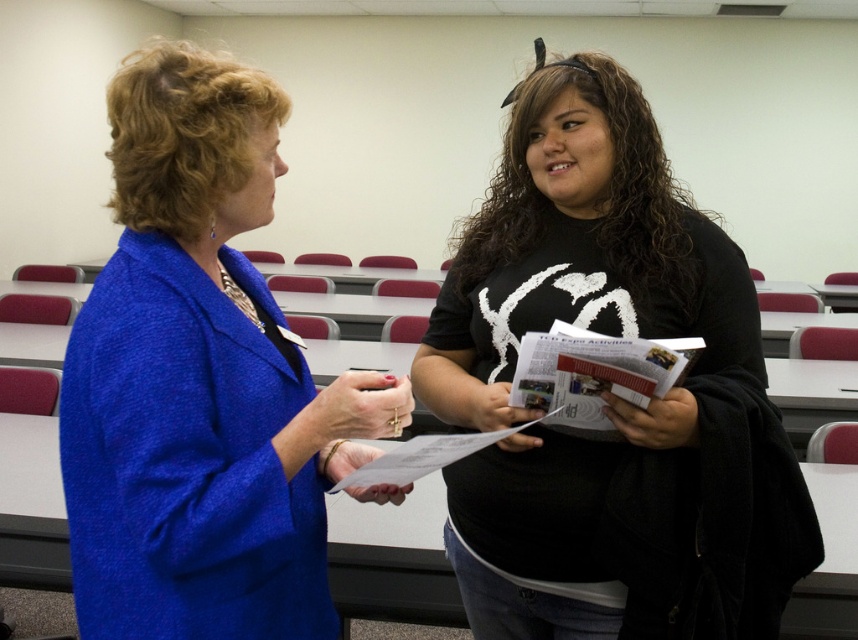
You are an assistant helping to organize a clothing donation drive. You have to decide whether the blue textured blazer at left can be placed in the same box as the black matte shirt at center. The box can only accommodate items that are narrower than the shirt. Can the blazer fit in the box?

The blue textured blazer at left has a lesser width compared to the black matte shirt at center, so it can fit in the box since it is narrower than the shirt.

You are designing a clothing catalog and need to place the blue textured blazer at left and the black matte shirt at center next to each other. Based on their sizes, which one should be placed on the left side to maintain visual balance?

The blue textured blazer at left should be placed on the left side since it is smaller in size compared to the black matte shirt at center, which helps in maintaining visual balance by balancing the overall composition.

Based on the scene description, which object is shorter in height between the blue textured blazer at left and the black matte shirt at center?

The blue textured blazer at left has a lesser height compared to the black matte shirt at center.